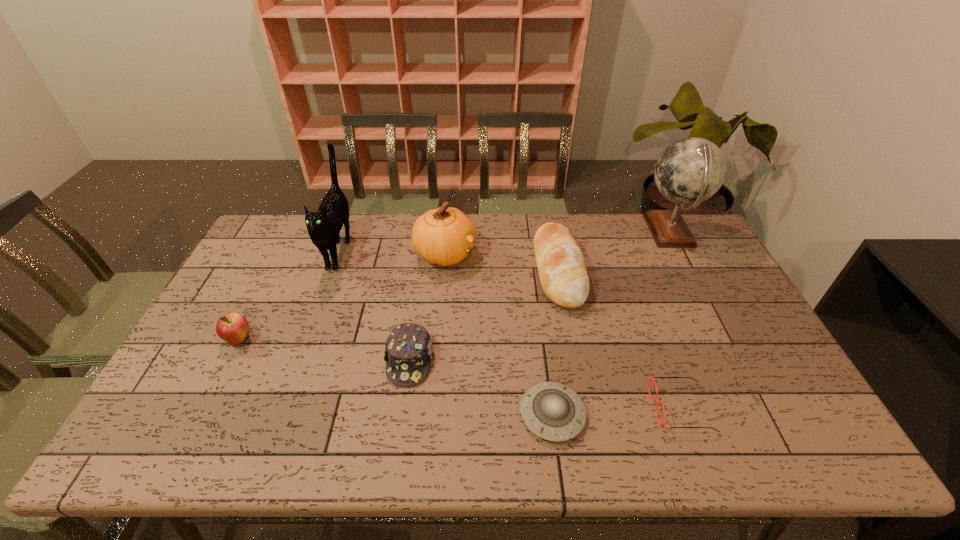
In the image, there is a desktop. Where is `vacant space at the far edge`? The width and height of the screenshot is (960, 540). vacant space at the far edge is located at coordinates (350, 228).

This screenshot has width=960, height=540. In the image, there is a desktop. Find the location of `vacant space at the left edge`. vacant space at the left edge is located at coordinates (261, 285).

In the image, there is a desktop. Where is `free space at the right edge`? The width and height of the screenshot is (960, 540). free space at the right edge is located at coordinates (684, 275).

Locate an element on the screen. The image size is (960, 540). vacant area that lies between the sixth tallest object and the leftmost object is located at coordinates (324, 350).

The width and height of the screenshot is (960, 540). I want to click on free spot between the second object from left to right and the shortest object, so click(x=445, y=332).

This screenshot has width=960, height=540. Identify the location of free spot between the rightmost object and the headwear. (540, 296).

This screenshot has width=960, height=540. Identify the location of blank region between the globe and the shortest object. (611, 323).

Where is `unoccupied area between the bread and the headwear`? The width and height of the screenshot is (960, 540). unoccupied area between the bread and the headwear is located at coordinates (484, 315).

Where is `vacant space that is in between the cat and the sixth tallest object`? The width and height of the screenshot is (960, 540). vacant space that is in between the cat and the sixth tallest object is located at coordinates (374, 305).

Locate an element on the screen. This screenshot has width=960, height=540. free space between the headwear and the seventh object from right to left is located at coordinates (374, 305).